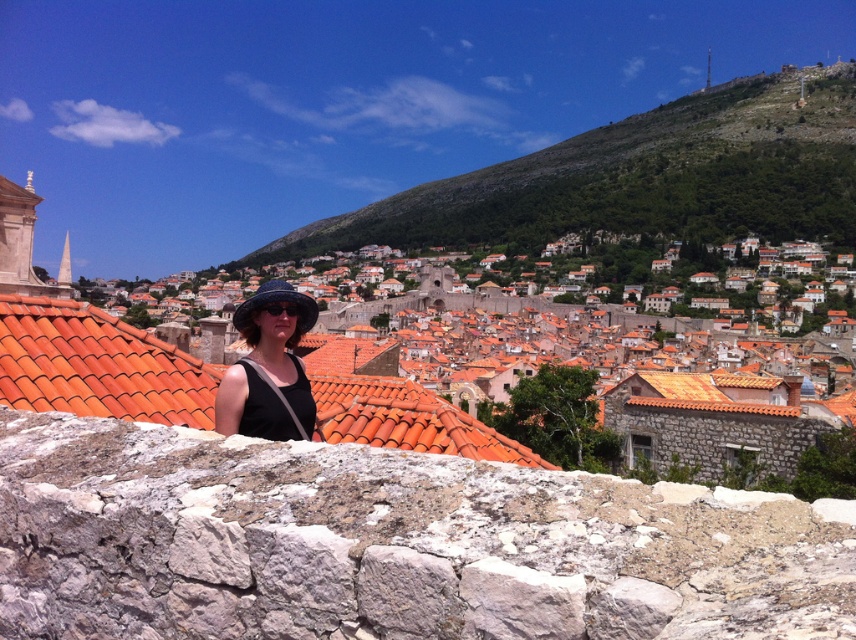
Based on the coordinates provided, which object in the image is located at point (97, 365)?

The orange clay tiles at center are located at point (97, 365).